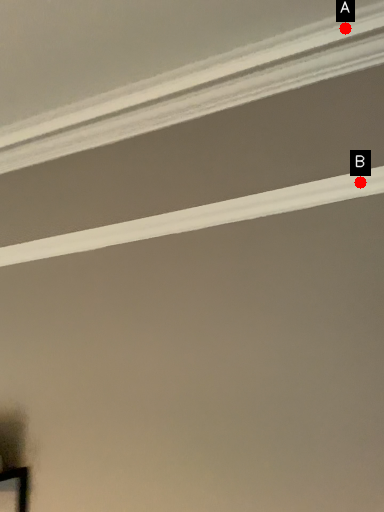
Question: Two points are circled on the image, labeled by A and B beside each circle. Among these points, which one is nearest to the camera?

Choices:
 (A) A is closer
 (B) B is closer

Answer: (B)